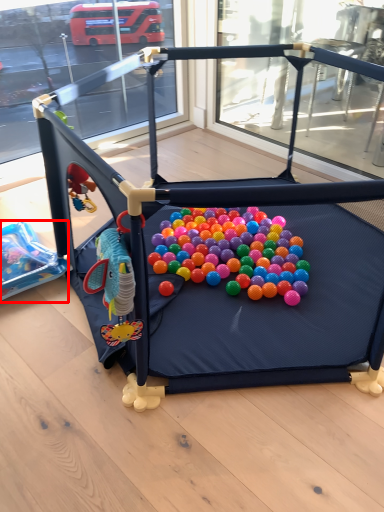
Question: In this image, where is toy (annotated by the red box) located relative to toy?

Choices:
 (A) right
 (B) left

Answer: (B)